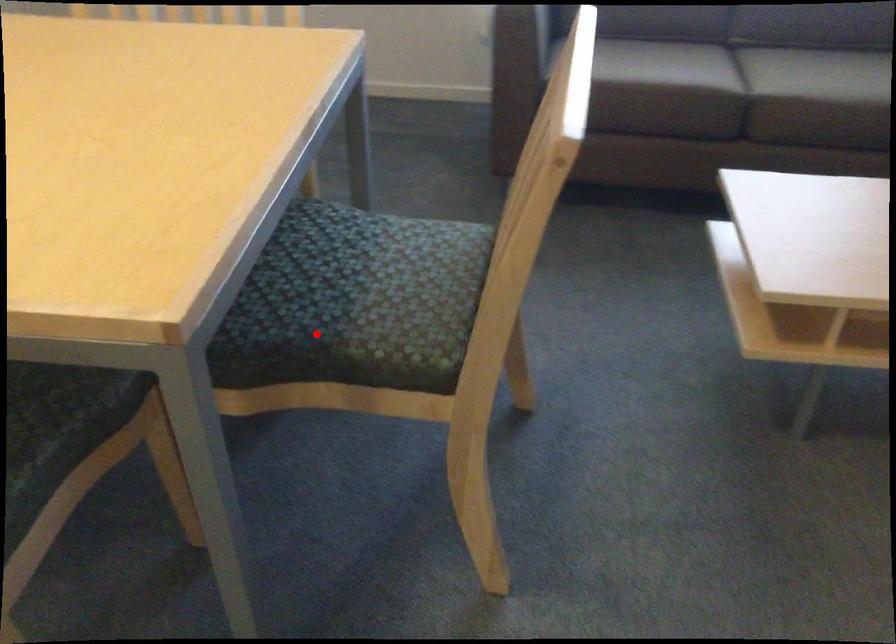
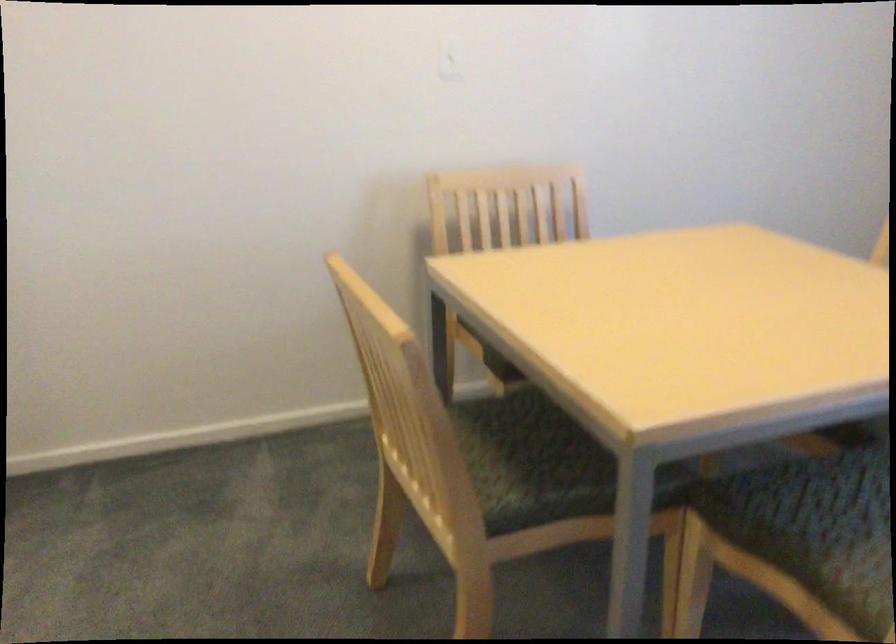
The point at the highlighted location is marked in the first image. Where is the corresponding point in the second image?

(798, 541)